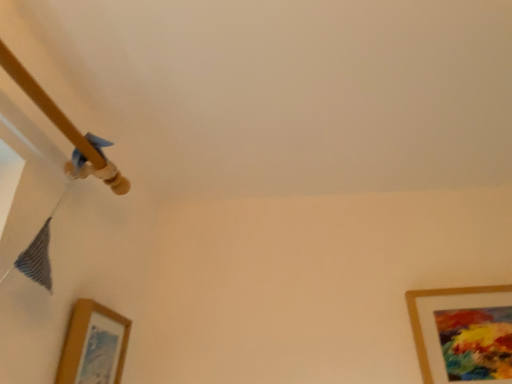
The width and height of the screenshot is (512, 384). Describe the element at coordinates (93, 345) in the screenshot. I see `wooden picture frame at lower left, arranged as the second picture frame when viewed from the right` at that location.

At what (x,y) coordinates should I click in order to perform the action: click on wooden picture frame at lower left, arranged as the second picture frame when viewed from the right. Please return your answer as a coordinate pair (x, y). Looking at the image, I should click on (93, 345).

I want to click on gold matte picture frame at lower right, which appears as the 2th picture frame when viewed from the left, so click(x=463, y=333).

What do you see at coordinates (463, 333) in the screenshot? I see `gold matte picture frame at lower right, which appears as the first picture frame when viewed from the right` at bounding box center [463, 333].

Where is `wooden picture frame at lower left, the 1th picture frame in the left-to-right sequence`? Image resolution: width=512 pixels, height=384 pixels. wooden picture frame at lower left, the 1th picture frame in the left-to-right sequence is located at coordinates (93, 345).

Which is more to the left, wooden picture frame at lower left, the 1th picture frame in the left-to-right sequence, or gold matte picture frame at lower right, which appears as the first picture frame when viewed from the right?

wooden picture frame at lower left, the 1th picture frame in the left-to-right sequence, is more to the left.

Is wooden picture frame at lower left, the 1th picture frame in the left-to-right sequence, in front of or behind gold matte picture frame at lower right, which appears as the first picture frame when viewed from the right, in the image?

Clearly, wooden picture frame at lower left, the 1th picture frame in the left-to-right sequence, is in front of gold matte picture frame at lower right, which appears as the first picture frame when viewed from the right.

Which is in front, point (75, 375) or point (457, 301)?

The point (75, 375) is in front.

From the image's perspective, is wooden picture frame at lower left, the 1th picture frame in the left-to-right sequence, above or below gold matte picture frame at lower right, which appears as the first picture frame when viewed from the right?

Clearly, from the image's perspective, wooden picture frame at lower left, the 1th picture frame in the left-to-right sequence, is above gold matte picture frame at lower right, which appears as the first picture frame when viewed from the right.

From a real-world perspective, which is physically below, wooden picture frame at lower left, arranged as the second picture frame when viewed from the right, or gold matte picture frame at lower right, which appears as the 2th picture frame when viewed from the left?

In real-world perspective, wooden picture frame at lower left, arranged as the second picture frame when viewed from the right, is lower.

Based on the photo, which object is wider, wooden picture frame at lower left, the 1th picture frame in the left-to-right sequence, or gold matte picture frame at lower right, which appears as the first picture frame when viewed from the right?

Wider between the two is wooden picture frame at lower left, the 1th picture frame in the left-to-right sequence.

Considering the sizes of objects wooden picture frame at lower left, arranged as the second picture frame when viewed from the right, and gold matte picture frame at lower right, which appears as the first picture frame when viewed from the right, in the image provided, who is taller, wooden picture frame at lower left, arranged as the second picture frame when viewed from the right, or gold matte picture frame at lower right, which appears as the first picture frame when viewed from the right,?

gold matte picture frame at lower right, which appears as the first picture frame when viewed from the right.

Considering the sizes of wooden picture frame at lower left, arranged as the second picture frame when viewed from the right, and gold matte picture frame at lower right, which appears as the 2th picture frame when viewed from the left, in the image, is wooden picture frame at lower left, arranged as the second picture frame when viewed from the right, bigger or smaller than gold matte picture frame at lower right, which appears as the 2th picture frame when viewed from the left,?

wooden picture frame at lower left, arranged as the second picture frame when viewed from the right, is smaller than gold matte picture frame at lower right, which appears as the 2th picture frame when viewed from the left.

Can we say wooden picture frame at lower left, arranged as the second picture frame when viewed from the right, lies outside gold matte picture frame at lower right, which appears as the first picture frame when viewed from the right?

Yes.

Are wooden picture frame at lower left, the 1th picture frame in the left-to-right sequence, and gold matte picture frame at lower right, which appears as the first picture frame when viewed from the right, making contact?

wooden picture frame at lower left, the 1th picture frame in the left-to-right sequence, and gold matte picture frame at lower right, which appears as the first picture frame when viewed from the right, are not in contact.

Consider the image. Is wooden picture frame at lower left, arranged as the second picture frame when viewed from the right, oriented away from gold matte picture frame at lower right, which appears as the first picture frame when viewed from the right?

No, wooden picture frame at lower left, arranged as the second picture frame when viewed from the right, is not facing away from gold matte picture frame at lower right, which appears as the first picture frame when viewed from the right.

How much distance is there between wooden picture frame at lower left, the 1th picture frame in the left-to-right sequence, and gold matte picture frame at lower right, which appears as the first picture frame when viewed from the right?

A distance of 37.85 inches exists between wooden picture frame at lower left, the 1th picture frame in the left-to-right sequence, and gold matte picture frame at lower right, which appears as the first picture frame when viewed from the right.

Locate an element on the screen. picture frame lying on the right of wooden picture frame at lower left, arranged as the second picture frame when viewed from the right is located at coordinates (463, 333).

Is gold matte picture frame at lower right, which appears as the 2th picture frame when viewed from the left, at the left side of wooden picture frame at lower left, the 1th picture frame in the left-to-right sequence?

No, gold matte picture frame at lower right, which appears as the 2th picture frame when viewed from the left, is not to the left of wooden picture frame at lower left, the 1th picture frame in the left-to-right sequence.

Considering the relative positions of gold matte picture frame at lower right, which appears as the 2th picture frame when viewed from the left, and wooden picture frame at lower left, arranged as the second picture frame when viewed from the right, in the image provided, is gold matte picture frame at lower right, which appears as the 2th picture frame when viewed from the left, in front of wooden picture frame at lower left, arranged as the second picture frame when viewed from the right,?

No, gold matte picture frame at lower right, which appears as the 2th picture frame when viewed from the left, is further to the viewer.

Is point (496, 321) positioned in front of point (85, 343)?

No.

From the image's perspective, is gold matte picture frame at lower right, which appears as the 2th picture frame when viewed from the left, below wooden picture frame at lower left, arranged as the second picture frame when viewed from the right?

Yes, from the image's perspective, gold matte picture frame at lower right, which appears as the 2th picture frame when viewed from the left, is beneath wooden picture frame at lower left, arranged as the second picture frame when viewed from the right.

From a real-world perspective, which is physically below, gold matte picture frame at lower right, which appears as the 2th picture frame when viewed from the left, or wooden picture frame at lower left, arranged as the second picture frame when viewed from the right?

wooden picture frame at lower left, arranged as the second picture frame when viewed from the right, is physically lower.

Considering the sizes of objects gold matte picture frame at lower right, which appears as the first picture frame when viewed from the right, and wooden picture frame at lower left, arranged as the second picture frame when viewed from the right, in the image provided, who is thinner, gold matte picture frame at lower right, which appears as the first picture frame when viewed from the right, or wooden picture frame at lower left, arranged as the second picture frame when viewed from the right,?

With smaller width is gold matte picture frame at lower right, which appears as the first picture frame when viewed from the right.

Looking at this image, in terms of height, does gold matte picture frame at lower right, which appears as the 2th picture frame when viewed from the left, look taller or shorter compared to wooden picture frame at lower left, arranged as the second picture frame when viewed from the right?

In the image, gold matte picture frame at lower right, which appears as the 2th picture frame when viewed from the left, appears to be taller than wooden picture frame at lower left, arranged as the second picture frame when viewed from the right.

Considering the relative sizes of gold matte picture frame at lower right, which appears as the first picture frame when viewed from the right, and wooden picture frame at lower left, the 1th picture frame in the left-to-right sequence, in the image provided, is gold matte picture frame at lower right, which appears as the first picture frame when viewed from the right, smaller than wooden picture frame at lower left, the 1th picture frame in the left-to-right sequence,?

No, gold matte picture frame at lower right, which appears as the first picture frame when viewed from the right, is not smaller than wooden picture frame at lower left, the 1th picture frame in the left-to-right sequence.

Is wooden picture frame at lower left, arranged as the second picture frame when viewed from the right, completely or partially inside gold matte picture frame at lower right, which appears as the 2th picture frame when viewed from the left?

That's incorrect, wooden picture frame at lower left, arranged as the second picture frame when viewed from the right, is not inside gold matte picture frame at lower right, which appears as the 2th picture frame when viewed from the left.

Is gold matte picture frame at lower right, which appears as the first picture frame when viewed from the right, far away from wooden picture frame at lower left, arranged as the second picture frame when viewed from the right?

No, there isn't a large distance between gold matte picture frame at lower right, which appears as the first picture frame when viewed from the right, and wooden picture frame at lower left, arranged as the second picture frame when viewed from the right.

Is gold matte picture frame at lower right, which appears as the 2th picture frame when viewed from the left, facing towards wooden picture frame at lower left, the 1th picture frame in the left-to-right sequence?

No, gold matte picture frame at lower right, which appears as the 2th picture frame when viewed from the left, is not oriented towards wooden picture frame at lower left, the 1th picture frame in the left-to-right sequence.

From the picture: What's the angular difference between gold matte picture frame at lower right, which appears as the 2th picture frame when viewed from the left, and wooden picture frame at lower left, arranged as the second picture frame when viewed from the right,'s facing directions?

They differ by 90 degrees in their facing directions.

Identify the location of picture frame in front of the gold matte picture frame at lower right, which appears as the first picture frame when viewed from the right. Image resolution: width=512 pixels, height=384 pixels. (93, 345).

You are a GUI agent. You are given a task and a screenshot of the screen. Output one action in this format:
    pyautogui.click(x=<x>, y=<y>)
    Task: Click on the picture frame behind the wooden picture frame at lower left, arranged as the second picture frame when viewed from the right
    This screenshot has width=512, height=384.
    Given the screenshot: What is the action you would take?
    pyautogui.click(x=463, y=333)

Find the location of `picture frame above the wooden picture frame at lower left, the 1th picture frame in the left-to-right sequence (from a real-world perspective)`. picture frame above the wooden picture frame at lower left, the 1th picture frame in the left-to-right sequence (from a real-world perspective) is located at coordinates (463, 333).